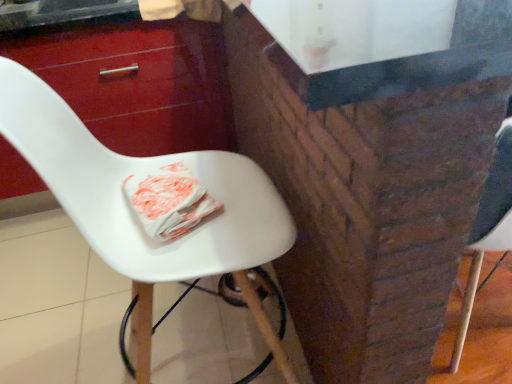
Describe the element at coordinates (137, 81) in the screenshot. The image size is (512, 384). I see `glossy wood drawer at upper left` at that location.

Image resolution: width=512 pixels, height=384 pixels. Identify the location of glossy wood drawer at upper left. (137, 81).

This screenshot has width=512, height=384. What do you see at coordinates (134, 211) in the screenshot? I see `white plastic chair at center` at bounding box center [134, 211].

Where is `white plastic chair at center`? white plastic chair at center is located at coordinates (134, 211).

The height and width of the screenshot is (384, 512). Identify the location of glossy wood drawer at upper left. click(137, 81).

In the image, is glossy wood drawer at upper left on the left side or the right side of white plastic chair at center?

From the image, it's evident that glossy wood drawer at upper left is to the left of white plastic chair at center.

Based on the photo, considering the relative positions of glossy wood drawer at upper left and white plastic chair at center in the image provided, is glossy wood drawer at upper left in front of white plastic chair at center?

No, glossy wood drawer at upper left is further to the viewer.

Is point (166, 37) positioned behind point (61, 181)?

Yes.

From the image's perspective, between glossy wood drawer at upper left and white plastic chair at center, which one is located above?

glossy wood drawer at upper left, from the image's perspective.

From a real-world perspective, who is located lower, glossy wood drawer at upper left or white plastic chair at center?

glossy wood drawer at upper left, from a real-world perspective.

Considering the sizes of objects glossy wood drawer at upper left and white plastic chair at center in the image provided, who is thinner, glossy wood drawer at upper left or white plastic chair at center?

Thinner between the two is white plastic chair at center.

Considering the relative sizes of glossy wood drawer at upper left and white plastic chair at center in the image provided, is glossy wood drawer at upper left taller than white plastic chair at center?

Incorrect, the height of glossy wood drawer at upper left is not larger of that of white plastic chair at center.

Between glossy wood drawer at upper left and white plastic chair at center, which one has larger size?

Bigger between the two is glossy wood drawer at upper left.

Would you say glossy wood drawer at upper left contains white plastic chair at center?

No, white plastic chair at center is not a part of glossy wood drawer at upper left.

Is glossy wood drawer at upper left with white plastic chair at center?

They are not placed beside each other.

Could you tell me if glossy wood drawer at upper left is turned towards white plastic chair at center?

Yes, glossy wood drawer at upper left faces towards white plastic chair at center.

Can you tell me how much glossy wood drawer at upper left and white plastic chair at center differ in facing direction?

91.7 degrees.

Locate an element on the screen. drawer on the left side of white plastic chair at center is located at coordinates (137, 81).

Between white plastic chair at center and glossy wood drawer at upper left, which one appears on the right side from the viewer's perspective?

white plastic chair at center.

Which is in front, white plastic chair at center or glossy wood drawer at upper left?

white plastic chair at center is closer to the camera.

Is point (137, 348) positioned in front of point (24, 174)?

Yes, it is in front of point (24, 174).

From the image's perspective, which one is positioned lower, white plastic chair at center or glossy wood drawer at upper left?

white plastic chair at center, from the image's perspective.

From a real-world perspective, who is located lower, white plastic chair at center or glossy wood drawer at upper left?

glossy wood drawer at upper left, from a real-world perspective.

Between white plastic chair at center and glossy wood drawer at upper left, which one has smaller width?

white plastic chair at center is thinner.

From their relative heights in the image, would you say white plastic chair at center is taller or shorter than glossy wood drawer at upper left?

Considering their sizes, white plastic chair at center has more height than glossy wood drawer at upper left.

Can you confirm if white plastic chair at center is bigger than glossy wood drawer at upper left?

Actually, white plastic chair at center might be smaller than glossy wood drawer at upper left.

Is white plastic chair at center situated inside glossy wood drawer at upper left or outside?

white plastic chair at center is outside glossy wood drawer at upper left.

Does white plastic chair at center touch glossy wood drawer at upper left?

white plastic chair at center and glossy wood drawer at upper left are not in contact.

Is white plastic chair at center turned away from glossy wood drawer at upper left?

That's not correct — white plastic chair at center is not looking away from glossy wood drawer at upper left.

How many degrees apart are the facing directions of white plastic chair at center and glossy wood drawer at upper left?

91.7 degrees.

Measure the distance from white plastic chair at center to glossy wood drawer at upper left.

white plastic chair at center and glossy wood drawer at upper left are 36.44 inches apart from each other.

I want to click on drawer located underneath the white plastic chair at center (from a real-world perspective), so click(137, 81).

This screenshot has height=384, width=512. I want to click on drawer behind the white plastic chair at center, so click(x=137, y=81).

Where is `drawer below the white plastic chair at center (from a real-world perspective)`? This screenshot has width=512, height=384. drawer below the white plastic chair at center (from a real-world perspective) is located at coordinates (137, 81).